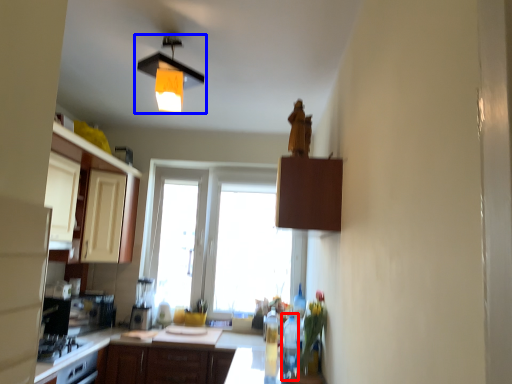
Question: Which object appears closest to the camera in this image, bottle (highlighted by a red box) or lamp (highlighted by a blue box)?

Choices:
 (A) bottle
 (B) lamp

Answer: (B)